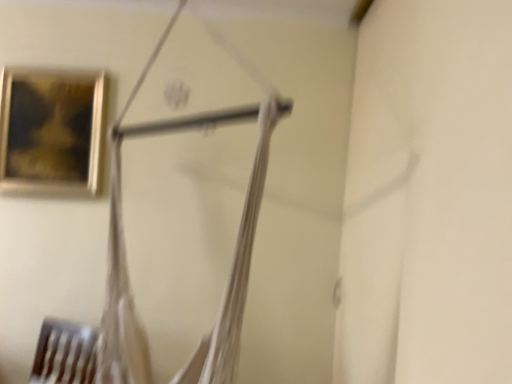
Question: From the image's perspective, relative to gold-framed painting at upper left, is white fabric hanger at center above or below?

Choices:
 (A) above
 (B) below

Answer: (B)

Question: From a real-world perspective, is white fabric hanger at center physically located above or below gold-framed painting at upper left?

Choices:
 (A) below
 (B) above

Answer: (A)

Question: From their relative heights in the image, would you say white fabric hanger at center is taller or shorter than gold-framed painting at upper left?

Choices:
 (A) tall
 (B) short

Answer: (A)

Question: Which is correct: gold-framed painting at upper left is inside white fabric hanger at center, or outside of it?

Choices:
 (A) inside
 (B) outside

Answer: (B)

Question: Is gold-framed painting at upper left wider or thinner than white fabric hanger at center?

Choices:
 (A) wide
 (B) thin

Answer: (B)

Question: From the image's perspective, is gold-framed painting at upper left above or below white fabric hanger at center?

Choices:
 (A) below
 (B) above

Answer: (B)

Question: In the image, is gold-framed painting at upper left on the left side or the right side of white fabric hanger at center?

Choices:
 (A) left
 (B) right

Answer: (A)